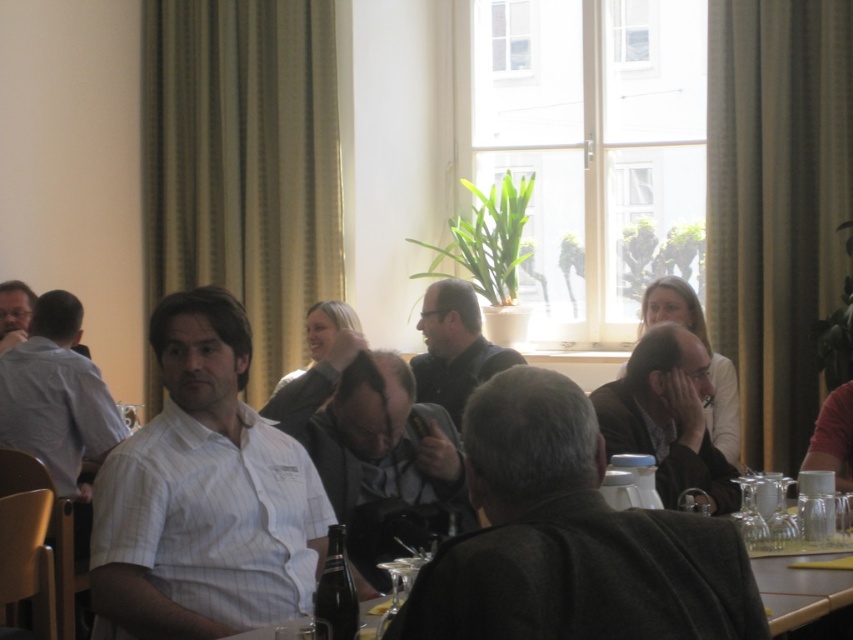
Measure the distance between dark brown leather jacket at center and camera.

dark brown leather jacket at center is 2.72 meters from camera.

Between dark brown leather jacket at center and clear glassware at center, which one has less height?

clear glassware at center is shorter.

Which is behind, point (627, 449) or point (822, 556)?

The point (627, 449) is more distant.

Where is `dark brown leather jacket at center`? The height and width of the screenshot is (640, 853). dark brown leather jacket at center is located at coordinates (666, 417).

Where is `dark gray fabric jacket at center`? Image resolution: width=853 pixels, height=640 pixels. dark gray fabric jacket at center is located at coordinates (570, 540).

Describe the element at coordinates (570, 540) in the screenshot. The width and height of the screenshot is (853, 640). I see `dark gray fabric jacket at center` at that location.

Who is more distant from viewer, [555,401] or [772,625]?

The point [772,625] is more distant.

Find the location of a particular element. dark gray fabric jacket at center is located at coordinates (570, 540).

Between white striped shirt at center and dark brown leather jacket at center, which one is positioned lower?

Positioned lower is white striped shirt at center.

Does white striped shirt at center have a lesser height compared to dark brown leather jacket at center?

No.

The height and width of the screenshot is (640, 853). What do you see at coordinates (204, 496) in the screenshot?
I see `white striped shirt at center` at bounding box center [204, 496].

You are a GUI agent. You are given a task and a screenshot of the screen. Output one action in this format:
    pyautogui.click(x=<x>, y=<y>)
    Task: Click on the white striped shirt at center
    Image resolution: width=853 pixels, height=640 pixels.
    Given the screenshot: What is the action you would take?
    pyautogui.click(x=204, y=496)